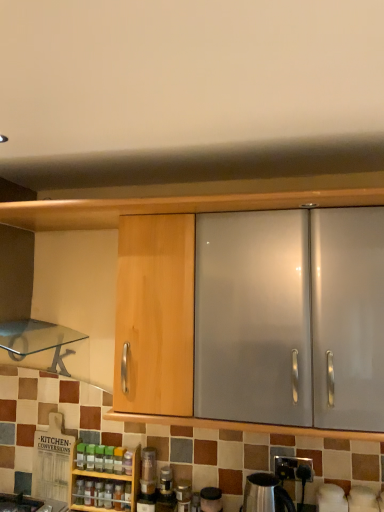
Question: Which direction should I rotate to face translucent plastic bottles at center, the first bottle in the left-to-right sequence, — up or down?

Choices:
 (A) down
 (B) up

Answer: (A)

Question: In which direction should I rotate to look at green plastic bottle at center, which is the 6th bottle in right-to-left order?

Choices:
 (A) right
 (B) left

Answer: (B)

Question: Would you consider green plastic bottle at lower center, the fifth bottle positioned from the right, to be distant from white glossy kettle at lower right, which appears as the 1th appliance when viewed from the right?

Choices:
 (A) no
 (B) yes

Answer: (A)

Question: Does green plastic bottle at lower center, acting as the 4th bottle starting from the left, appear on the right side of white glossy kettle at lower right, which ranks as the 3th appliance in left-to-right order?

Choices:
 (A) no
 (B) yes

Answer: (A)

Question: Considering the relative sizes of green plastic bottle at lower center, acting as the 4th bottle starting from the left, and white glossy kettle at lower right, which ranks as the 3th appliance in left-to-right order, in the image provided, is green plastic bottle at lower center, acting as the 4th bottle starting from the left, bigger than white glossy kettle at lower right, which ranks as the 3th appliance in left-to-right order,?

Choices:
 (A) no
 (B) yes

Answer: (A)

Question: Does green plastic bottle at lower center, the fifth bottle positioned from the right, have a lesser height compared to white glossy kettle at lower right, which ranks as the 3th appliance in left-to-right order?

Choices:
 (A) yes
 (B) no

Answer: (A)

Question: Could you tell me if green plastic bottle at lower center, acting as the 4th bottle starting from the left, is turned towards white glossy kettle at lower right, which appears as the 1th appliance when viewed from the right?

Choices:
 (A) yes
 (B) no

Answer: (B)

Question: Is white glossy kettle at lower right, which appears as the 1th appliance when viewed from the right, inside green plastic bottle at lower center, acting as the 4th bottle starting from the left?

Choices:
 (A) no
 (B) yes

Answer: (A)

Question: Does satin silver kettle at lower center, marked as the second appliance in a right-to-left arrangement, come behind translucent plastic bottle at center, positioned as the 2th bottle in left-to-right order?

Choices:
 (A) yes
 (B) no

Answer: (B)

Question: Is satin silver kettle at lower center, marked as the second appliance in a right-to-left arrangement, touching translucent plastic bottle at center, arranged as the 7th bottle when viewed from the right?

Choices:
 (A) no
 (B) yes

Answer: (A)

Question: From a real-world perspective, is satin silver kettle at lower center, marked as the second appliance in a left-to-right arrangement, beneath translucent plastic bottle at center, positioned as the 2th bottle in left-to-right order?

Choices:
 (A) yes
 (B) no

Answer: (B)

Question: Is translucent plastic bottle at center, arranged as the 7th bottle when viewed from the right, a part of satin silver kettle at lower center, marked as the second appliance in a right-to-left arrangement?

Choices:
 (A) yes
 (B) no

Answer: (B)

Question: Is satin silver kettle at lower center, marked as the second appliance in a left-to-right arrangement, aimed at translucent plastic bottle at center, positioned as the 2th bottle in left-to-right order?

Choices:
 (A) yes
 (B) no

Answer: (B)

Question: Does satin silver kettle at lower center, marked as the second appliance in a left-to-right arrangement, have a greater width compared to translucent plastic bottle at center, positioned as the 2th bottle in left-to-right order?

Choices:
 (A) yes
 (B) no

Answer: (A)

Question: From a real-world perspective, does white glossy kettle at lower right, which ranks as the 3th appliance in left-to-right order, stand above translucent plastic bottles at center, which ranks as the eighth bottle in right-to-left order?

Choices:
 (A) no
 (B) yes

Answer: (A)